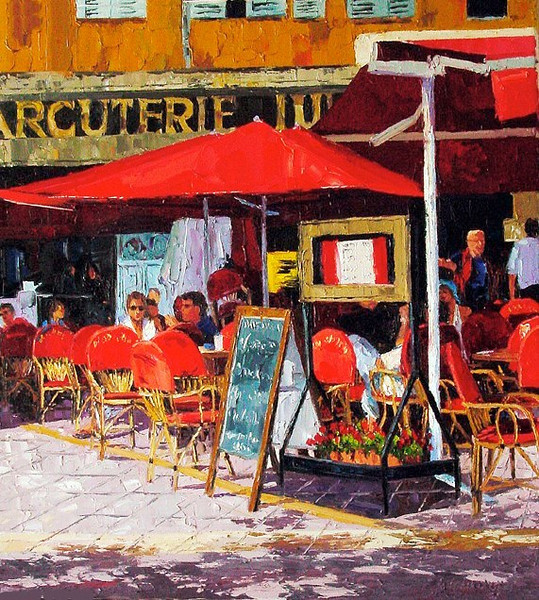
This screenshot has width=539, height=600. In order to click on window in this screenshot , I will do `click(490, 6)`.